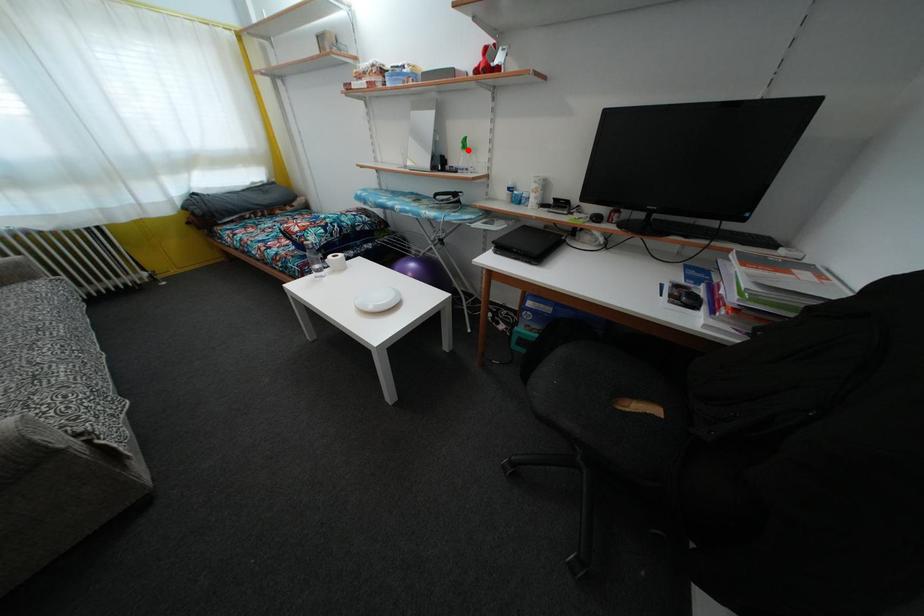
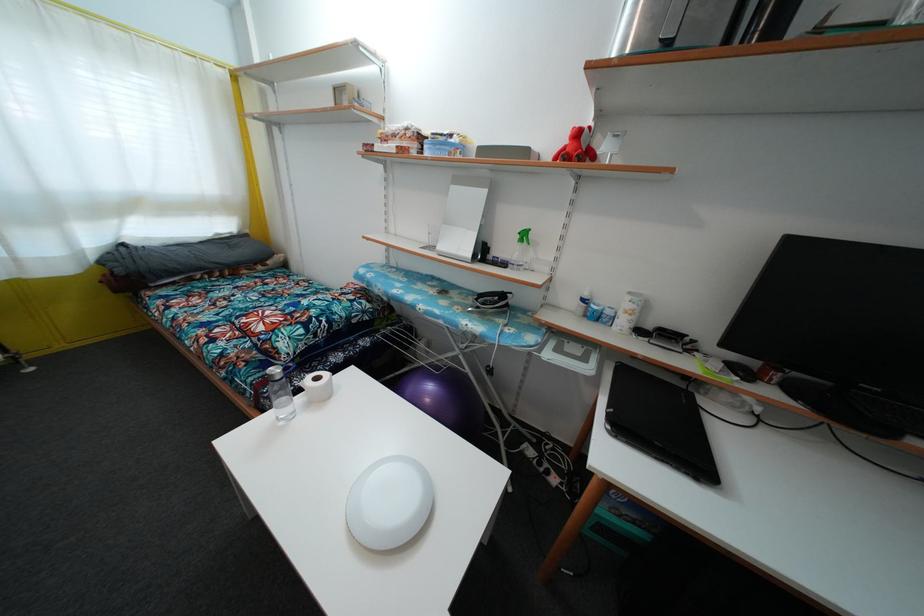
Question: I am providing you with two images of the same scene from different viewpoints. A red point is marked on the first image. At the location where the point appears in image 1, is it still visible in image 2?

Choices:
 (A) Yes
 (B) No

Answer: (A)